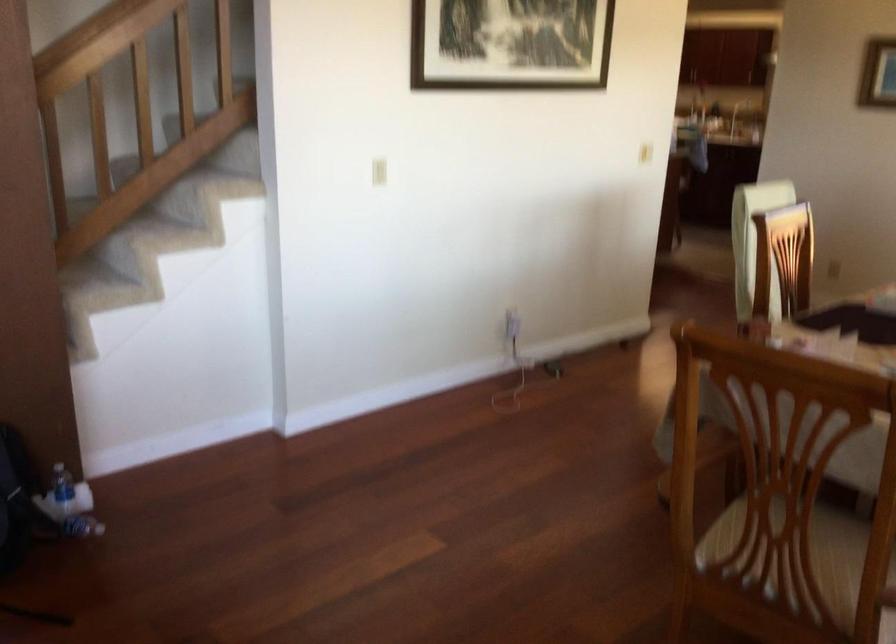
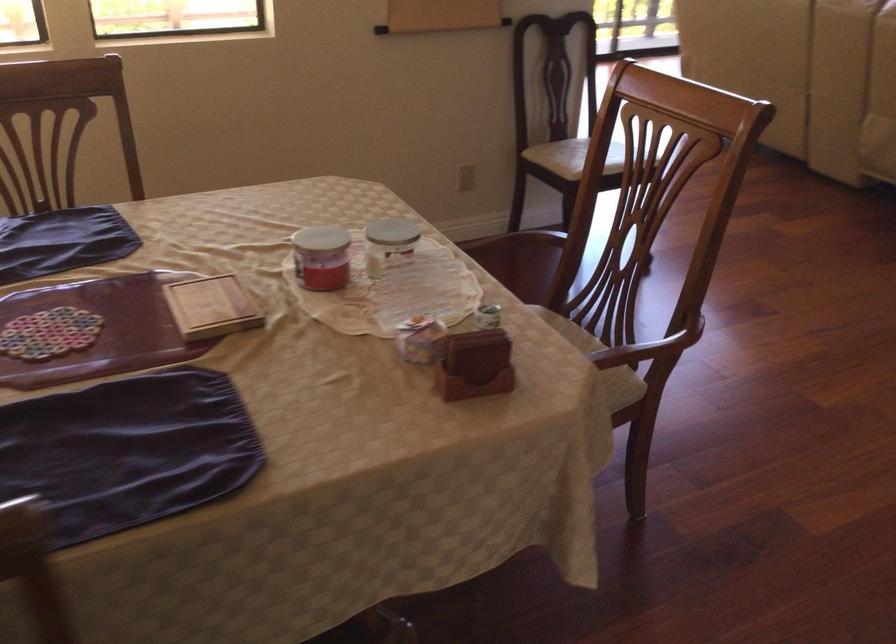
Question: I am providing you with two images of the same scene from different viewpoints. Which of the following objects are not visible in image2?

Choices:
 (A) small gift box
 (B) small wooden book
 (C) black electronic tablet
 (D) chair sitting surface

Answer: (D)